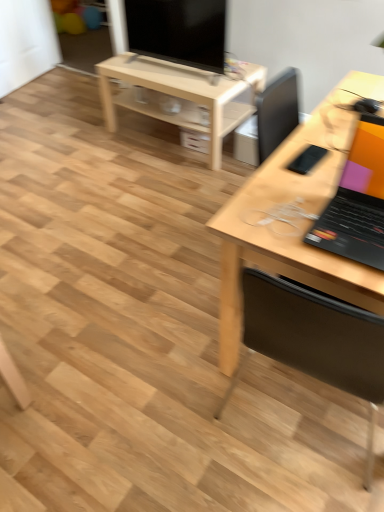
This screenshot has width=384, height=512. I want to click on free spot in front of light wood/unfinished table at center, so click(154, 183).